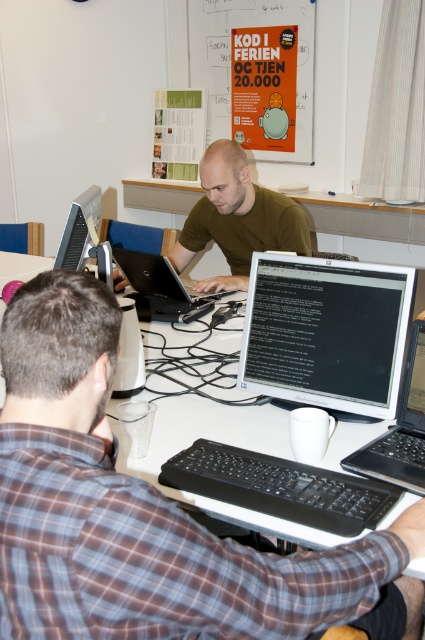
Which is more to the left, brown plaid shirt at center or black matte laptop at center?

From the viewer's perspective, black matte laptop at center appears more on the left side.

The width and height of the screenshot is (425, 640). Describe the element at coordinates (147, 513) in the screenshot. I see `brown plaid shirt at center` at that location.

Does point (73, 518) lie in front of point (153, 266)?

Yes, point (73, 518) is closer to viewer.

Where is `brown plaid shirt at center`? This screenshot has width=425, height=640. brown plaid shirt at center is located at coordinates (147, 513).

Is brown plaid shirt at center above black glossy laptop at center?

No, brown plaid shirt at center is not above black glossy laptop at center.

Is point (237, 625) behind point (418, 397)?

No, (237, 625) is in front of (418, 397).

Locate an element on the screen. This screenshot has height=640, width=425. brown plaid shirt at center is located at coordinates (147, 513).

Between black glossy laptop at center and black matte laptop at center, which one has less height?

black matte laptop at center is shorter.

Which is more to the left, black glossy laptop at center or black matte laptop at center?

Positioned to the left is black matte laptop at center.

Find the location of a particular element. black glossy laptop at center is located at coordinates (401, 428).